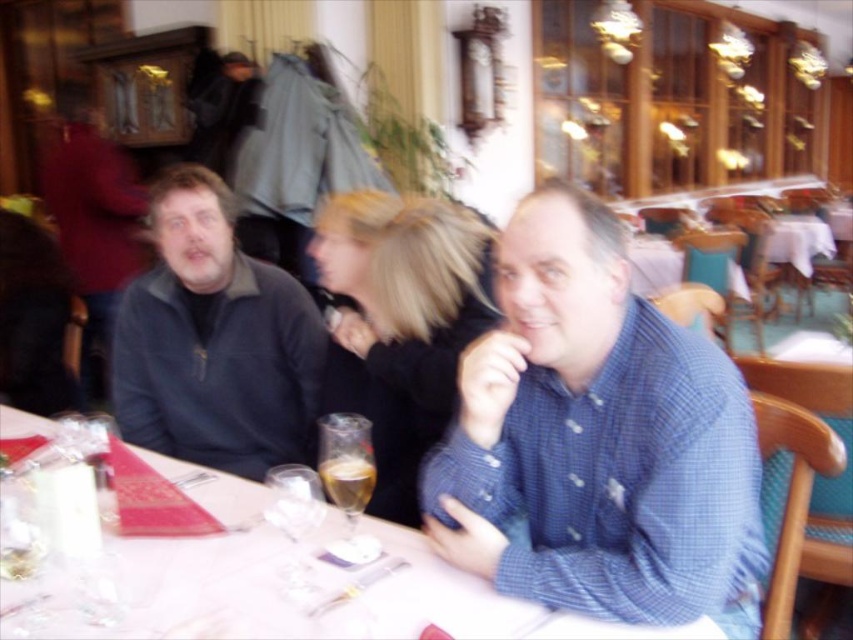
You are sitting at the table in the restaurant and want to reach the point marked as point (x=312, y=476). Is this point closer to you than the point marked as point (x=368, y=476)?

Yes, point (x=312, y=476) is closer to you than point (x=368, y=476) because it is in front of it.

You are sitting at the table in the restaurant and want to reach both the point at coordinates point (492, 616) and point (364, 490). Which point would you need to reach first if you are moving towards them from your current position?

You would need to reach point (364, 490) first because it is behind point (492, 616), so you must pass by point (492, 616) to get to the other point.

From the picture: You are a server in a restaurant and need to place a new order of appetizers on the table. The appetizers come in a tray that is the same size as the clear glass wine at center. Will the tray fit on the white glossy table at center without overhanging the edges?

The white glossy table at center is larger in size than the clear glass wine at center. Since the tray is the same size as the clear glass wine at center, it will fit on the white glossy table at center without overhanging the edges.